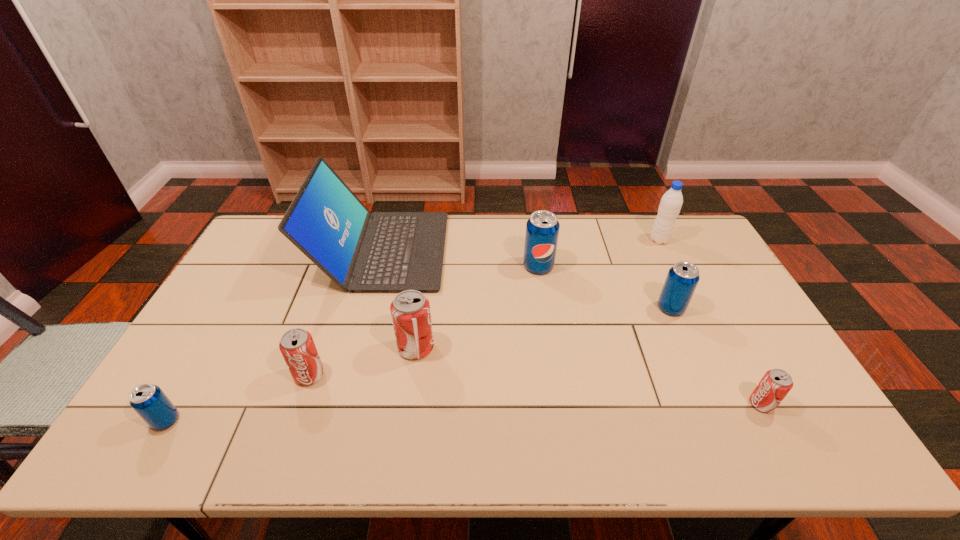
I want to click on the leftmost soda can, so click(148, 400).

At what (x,y) coordinates should I click in order to perform the action: click on the leftmost blue pop soda. Please return your answer as a coordinate pair (x, y). The height and width of the screenshot is (540, 960). Looking at the image, I should click on click(148, 400).

The width and height of the screenshot is (960, 540). In order to click on the rightmost pink soda can in this screenshot , I will do `click(776, 383)`.

Locate an element on the screen. The height and width of the screenshot is (540, 960). the nearest pink soda can is located at coordinates (776, 383).

This screenshot has height=540, width=960. Find the location of `free point located 0.210m on the screen of the gray laptop computer`. free point located 0.210m on the screen of the gray laptop computer is located at coordinates tap(505, 251).

Where is `vacant region located 0.310m on the front of the gray water bottle`? vacant region located 0.310m on the front of the gray water bottle is located at coordinates (694, 309).

This screenshot has height=540, width=960. In order to click on vacant space located 0.090m on the back of the fourth soda can from left to right in this screenshot , I will do `click(535, 240)`.

Locate an element on the screen. This screenshot has height=540, width=960. free space located on the right of the farthest pink soda can is located at coordinates (456, 348).

You are a GUI agent. You are given a task and a screenshot of the screen. Output one action in this format:
    pyautogui.click(x=<x>, y=<y>)
    Task: Click on the vacant area located on the left of the rightmost blue pop soda
    The image size is (960, 540).
    Given the screenshot: What is the action you would take?
    pyautogui.click(x=631, y=308)

Locate an element on the screen. The image size is (960, 540). vacant space located on the left of the fourth farthest soda can is located at coordinates (172, 375).